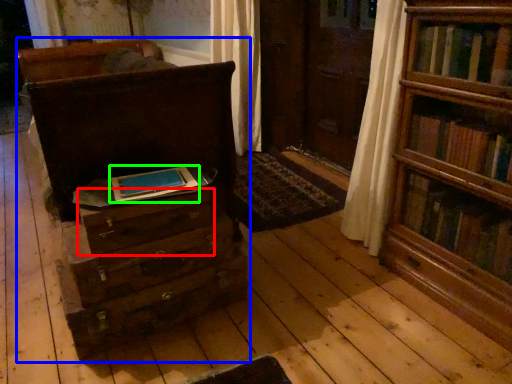
Question: Which is nearer to the drawer (highlighted by a red box)? chest of drawers (highlighted by a blue box) or paperback book (highlighted by a green box).

Choices:
 (A) chest of drawers
 (B) paperback book

Answer: (B)